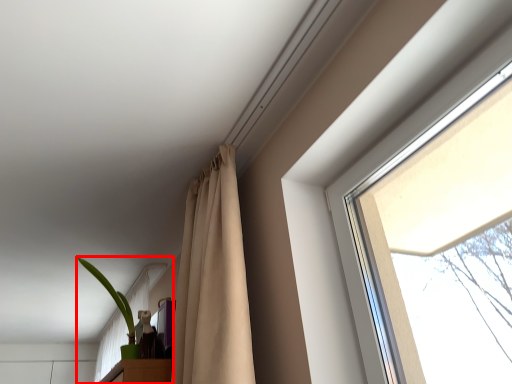
Question: Where is houseplant (annotated by the red box) located in relation to curtain in the image?

Choices:
 (A) left
 (B) right

Answer: (A)